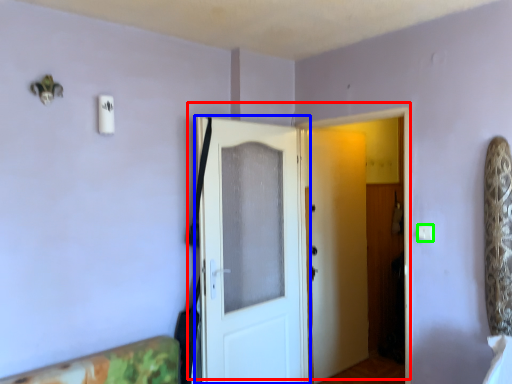
Question: Estimate the real-world distances between objects in this image. Which object is farther from door (highlighted by a red box), door (highlighted by a blue box) or light switch (highlighted by a green box)?

Choices:
 (A) door
 (B) light switch

Answer: (B)